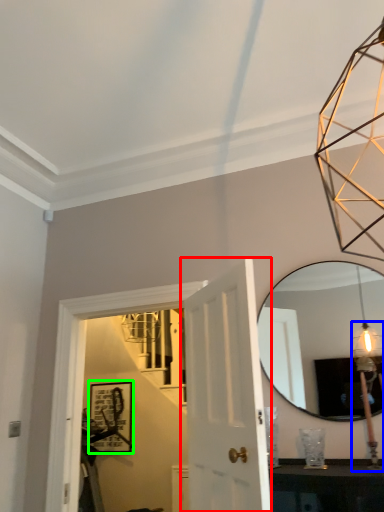
Question: Based on their relative distances, which object is farther from door (highlighted by a red box)? Choose from light fixture (highlighted by a blue box) and picture frame (highlighted by a green box).

Choices:
 (A) light fixture
 (B) picture frame

Answer: (B)